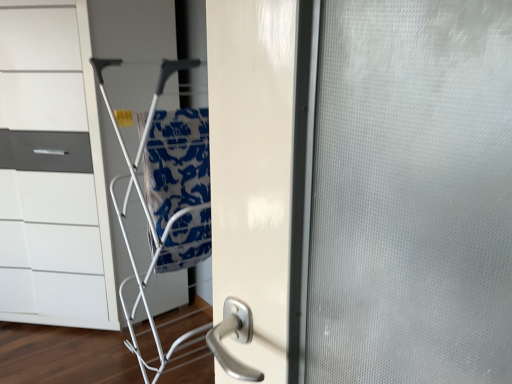
Question: Can you confirm if white glossy chest of drawers at left is thinner than blue printed fabric at center?

Choices:
 (A) yes
 (B) no

Answer: (B)

Question: Is white glossy chest of drawers at left not close to blue printed fabric at center?

Choices:
 (A) no
 (B) yes

Answer: (A)

Question: From a real-world perspective, does white glossy chest of drawers at left sit lower than blue printed fabric at center?

Choices:
 (A) yes
 (B) no

Answer: (A)

Question: From a real-world perspective, is white glossy chest of drawers at left on top of blue printed fabric at center?

Choices:
 (A) yes
 (B) no

Answer: (B)

Question: From the image's perspective, would you say white glossy chest of drawers at left is shown under blue printed fabric at center?

Choices:
 (A) no
 (B) yes

Answer: (A)

Question: From the image's perspective, is white glossy chest of drawers at left on blue printed fabric at center?

Choices:
 (A) yes
 (B) no

Answer: (A)

Question: Does silver metallic door handle at center have a greater width compared to white glossy chest of drawers at left?

Choices:
 (A) no
 (B) yes

Answer: (A)

Question: From a real-world perspective, is silver metallic door handle at center over white glossy chest of drawers at left?

Choices:
 (A) yes
 (B) no

Answer: (B)

Question: Considering the relative sizes of silver metallic door handle at center and white glossy chest of drawers at left in the image provided, is silver metallic door handle at center taller than white glossy chest of drawers at left?

Choices:
 (A) yes
 (B) no

Answer: (B)

Question: Is silver metallic door handle at center further to camera compared to white glossy chest of drawers at left?

Choices:
 (A) no
 (B) yes

Answer: (B)

Question: Considering the relative sizes of silver metallic door handle at center and white glossy chest of drawers at left in the image provided, is silver metallic door handle at center bigger than white glossy chest of drawers at left?

Choices:
 (A) yes
 (B) no

Answer: (B)

Question: Is the depth of silver metallic door handle at center less than that of white glossy chest of drawers at left?

Choices:
 (A) no
 (B) yes

Answer: (A)

Question: Is white glossy chest of drawers at left oriented away from silver metallic door handle at center?

Choices:
 (A) yes
 (B) no

Answer: (B)